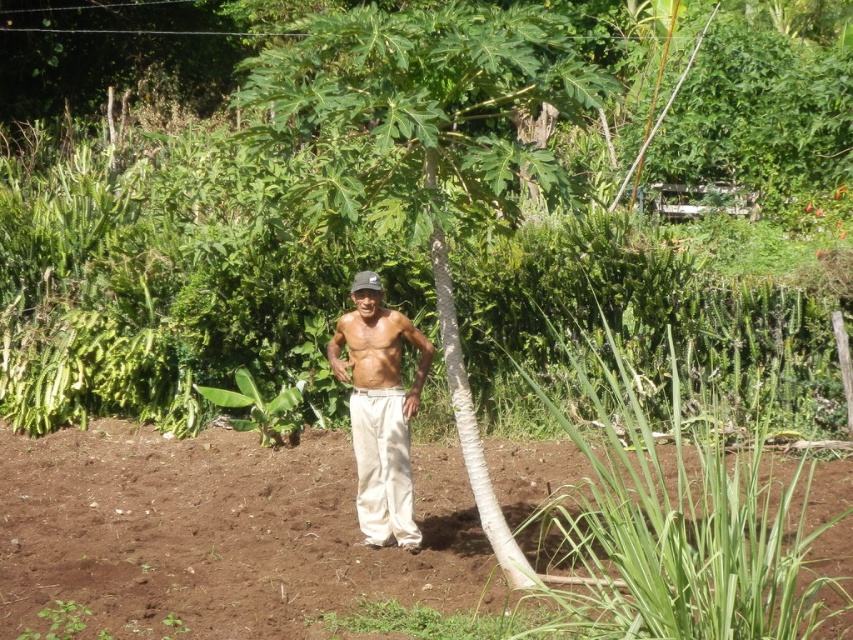
You are a gardener planning to plant a new flower bed. You see the brown soil at center and the green leafy banana tree at center. Which object is positioned lower in the scene?

The brown soil at center is located below the green leafy banana tree at center, so it is positioned lower in the scene.

You are a drone operator trying to capture a photo of the brown soil at center from the air. The drone has a maximum safe flying distance of 10 meters. Can you safely fly the drone to take the photo?

The distance between the brown soil at center and the camera is 8.45 meters, which is within the drone operator maximum safe flying distance of 10 meters. Yes, the drone can safely fly to take the photo.

Based on the scene description, where is the white cotton pants at center located in terms of coordinates?

The white cotton pants at center is located at coordinates point (x=380, y=413).